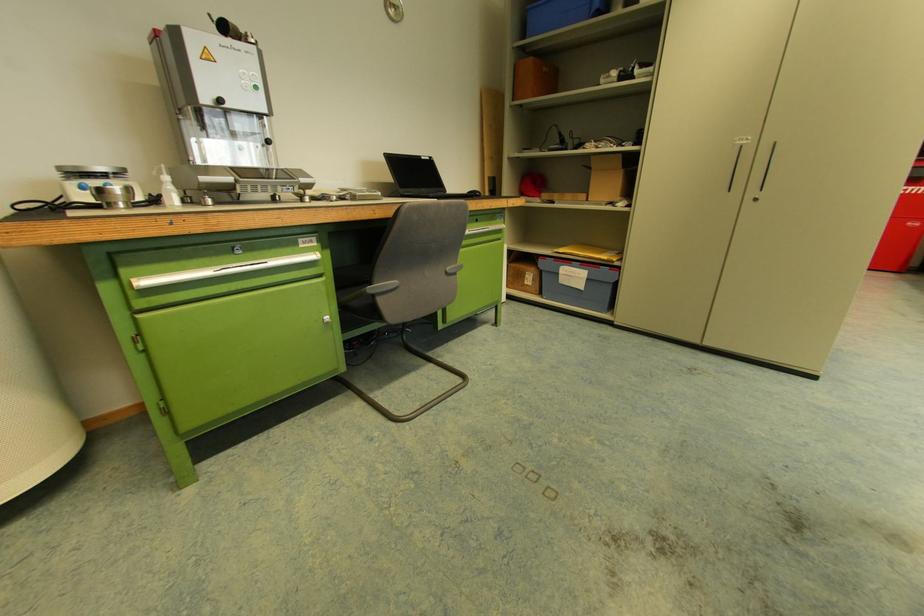
Which object does [523,276] point to?

It corresponds to the brown cardboard box in the image.